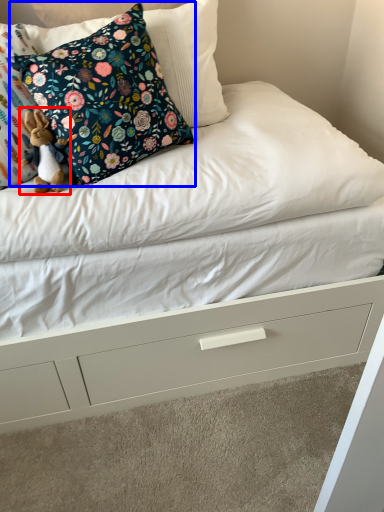
Question: Which of the following is the closest to the observer, toy (highlighted by a red box) or pillow (highlighted by a blue box)?

Choices:
 (A) toy
 (B) pillow

Answer: (B)